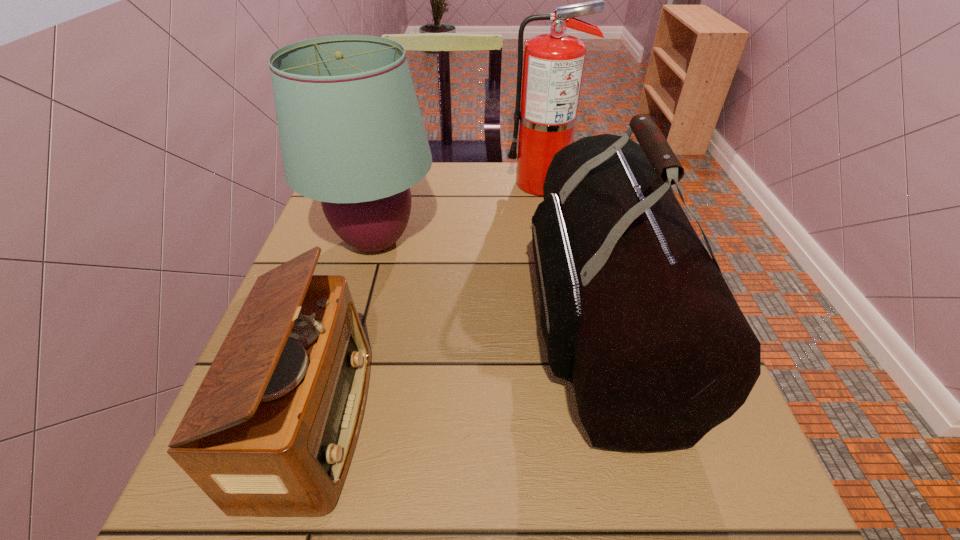
The image size is (960, 540). I want to click on free space located 0.210m on the front pocket of the duffel bag, so click(x=419, y=322).

The height and width of the screenshot is (540, 960). I want to click on blank area located 0.100m on the front panel of the shortest object, so click(x=428, y=421).

The width and height of the screenshot is (960, 540). Identify the location of fire extinguisher present at the far edge. (553, 64).

The image size is (960, 540). I want to click on lampshade present at the far edge, so click(352, 136).

The height and width of the screenshot is (540, 960). What are the coordinates of `object that is at the near edge` in the screenshot? It's located at (270, 432).

At what (x,y) coordinates should I click in order to perform the action: click on lampshade at the left edge. Please return your answer as a coordinate pair (x, y). Image resolution: width=960 pixels, height=540 pixels. Looking at the image, I should click on (352, 136).

The image size is (960, 540). In order to click on radio receiver that is at the left edge in this screenshot , I will do 270,432.

Locate an element on the screen. The image size is (960, 540). fire extinguisher located in the right edge section of the desktop is located at coordinates (553, 64).

I want to click on duffel bag that is at the right edge, so [x=634, y=312].

What are the coordinates of `object present at the far left corner` in the screenshot? It's located at (352, 136).